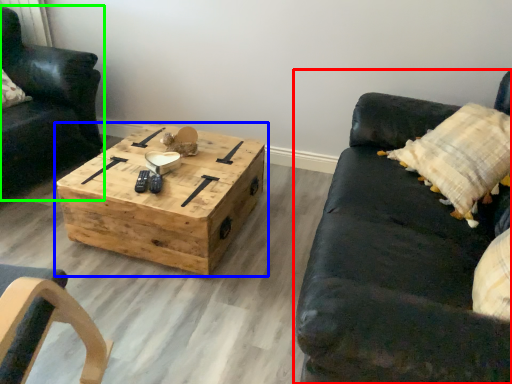
Question: Which object is positioned farthest from studio couch (highlighted by a red box)? Select from coffee table (highlighted by a blue box) and chair (highlighted by a green box).

Choices:
 (A) coffee table
 (B) chair

Answer: (B)